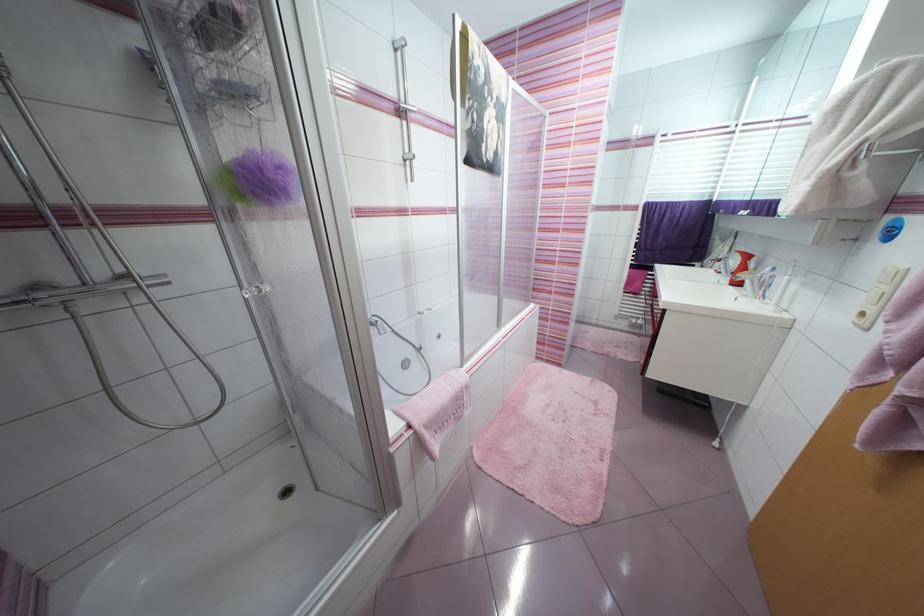
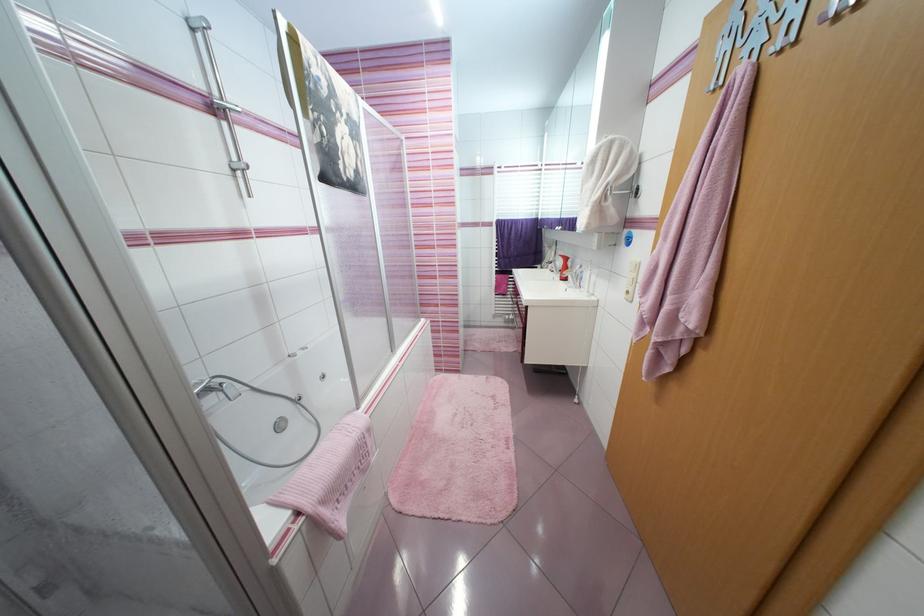
Find the pixel in the second image that matches point 410,367 in the first image.

(286, 428)